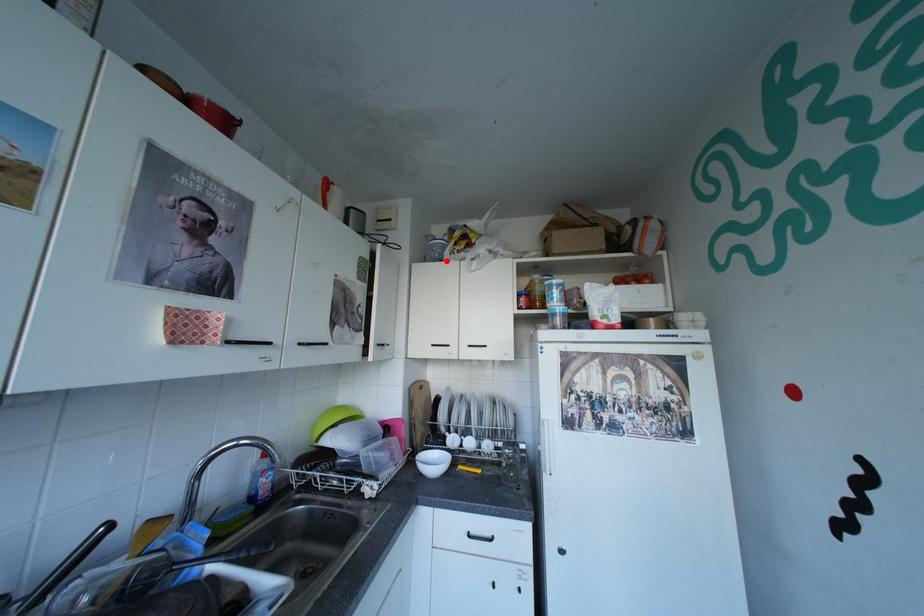
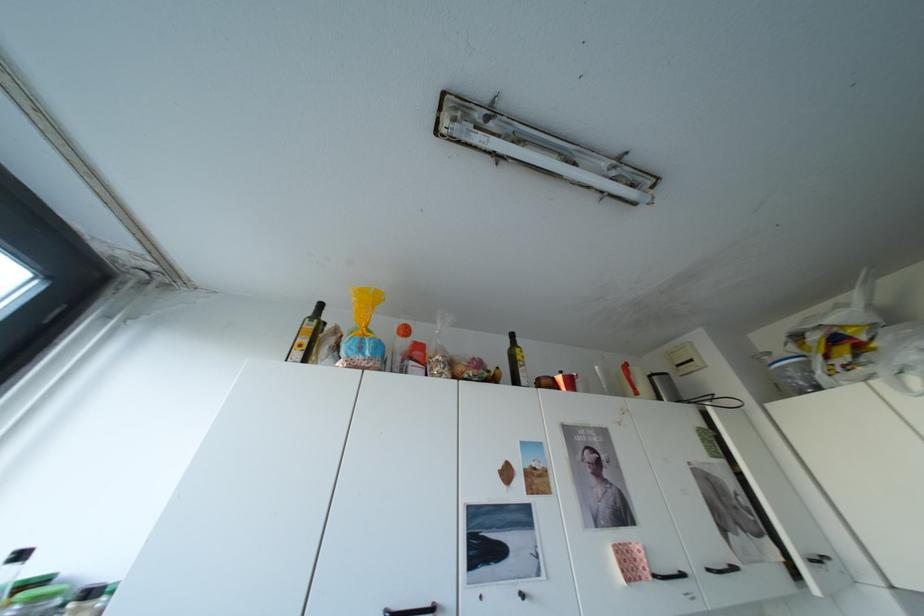
Find the pixel in the second image that matches the highlighted location in the first image.

(813, 391)